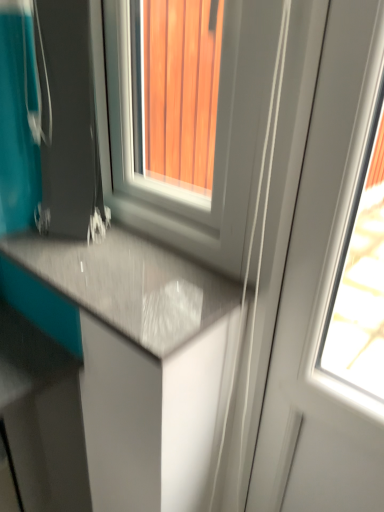
Question: Considering the relative sizes of matte gray countertop at lower left and white glossy window at center in the image provided, is matte gray countertop at lower left smaller than white glossy window at center?

Choices:
 (A) no
 (B) yes

Answer: (B)

Question: Is matte gray countertop at lower left further to the viewer compared to white glossy window at center?

Choices:
 (A) yes
 (B) no

Answer: (A)

Question: From a real-world perspective, is matte gray countertop at lower left under white glossy window at center?

Choices:
 (A) yes
 (B) no

Answer: (A)

Question: Could you tell me if matte gray countertop at lower left is facing white glossy window at center?

Choices:
 (A) yes
 (B) no

Answer: (B)

Question: Is matte gray countertop at lower left far away from white glossy window at center?

Choices:
 (A) no
 (B) yes

Answer: (A)

Question: From a real-world perspective, is white glossy window at center physically located above or below matte black suitcase at lower left?

Choices:
 (A) below
 (B) above

Answer: (B)

Question: Is white glossy window at center in front of or behind matte black suitcase at lower left in the image?

Choices:
 (A) behind
 (B) front

Answer: (B)

Question: Is white glossy window at center inside or outside of matte black suitcase at lower left?

Choices:
 (A) inside
 (B) outside

Answer: (B)

Question: From the image's perspective, is white glossy window at center above or below matte black suitcase at lower left?

Choices:
 (A) below
 (B) above

Answer: (B)

Question: Would you say white glossy screen door at right is inside or outside white glossy window at center?

Choices:
 (A) outside
 (B) inside

Answer: (A)

Question: In the image, is white glossy screen door at right positioned in front of or behind white glossy window at center?

Choices:
 (A) behind
 (B) front

Answer: (B)

Question: In terms of width, does white glossy screen door at right look wider or thinner when compared to white glossy window at center?

Choices:
 (A) wide
 (B) thin

Answer: (B)

Question: Considering the positions of point (289, 266) and point (226, 99), is point (289, 266) closer or farther from the camera than point (226, 99)?

Choices:
 (A) farther
 (B) closer

Answer: (A)

Question: Considering their positions, is white glossy window at center located in front of or behind white glossy screen door at right?

Choices:
 (A) front
 (B) behind

Answer: (B)

Question: In terms of height, does white glossy window at center look taller or shorter compared to white glossy screen door at right?

Choices:
 (A) tall
 (B) short

Answer: (B)